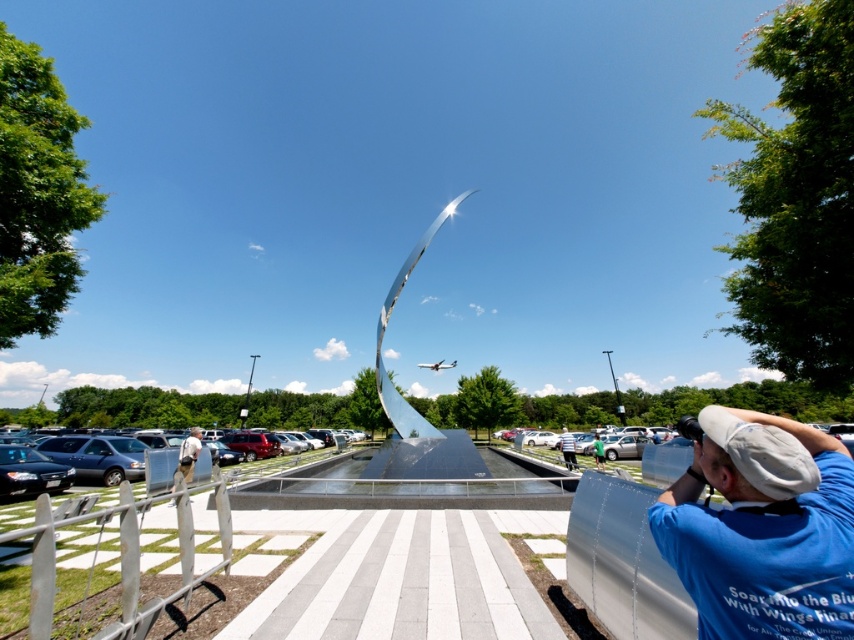
You are a photographer standing at the location of the khaki cotton pants at lower left. You want to take a photo of the white cotton shirt at center. Can you fit both the sculpture and the person in the frame without moving? Explain your reasoning.

The distance between the khaki cotton pants at lower left and the white cotton shirt at center is 17.21 meters. Since the sculpture is between them, it would likely block the view of the white cotton shirt at center unless the photographer moves. Therefore, you cannot fit both the sculpture and the person in the frame without moving.

You are standing in the outdoor scene and want to take a photo of the khaki cotton pants at lower left and the white cotton shirt at center. Which object should you frame first in your camera viewfinder to ensure both are in the shot?

You should frame the khaki cotton pants at lower left first since it is positioned to the left of the white cotton shirt at center, so starting with the leftmost object ensures both are included in the frame.